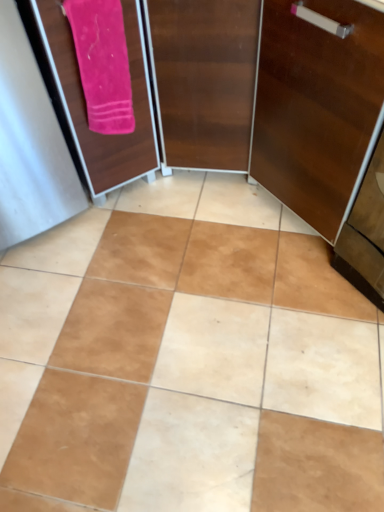
What is the approximate height of pink fabric screen door at upper left?

The height of pink fabric screen door at upper left is 80.57 centimeters.

What do you see at coordinates (85, 103) in the screenshot? I see `pink fabric screen door at upper left` at bounding box center [85, 103].

Describe the element at coordinates (316, 106) in the screenshot. This screenshot has height=512, width=384. I see `wooden cabinet at right` at that location.

In the scene shown: What is the approximate width of brown matte tile at center?

brown matte tile at center is 1.36 meters wide.

Locate an element on the screen. The height and width of the screenshot is (512, 384). brown matte tile at center is located at coordinates (187, 359).

Find the location of a particular element. This screenshot has height=512, width=384. pink fabric screen door at upper left is located at coordinates (85, 103).

Is wooden cabinet at right oriented away from brown matte tile at center?

No.

Is wooden cabinet at right not within brown matte tile at center?

wooden cabinet at right is positioned outside brown matte tile at center.

Is wooden cabinet at right next to brown matte tile at center and touching it?

wooden cabinet at right and brown matte tile at center are clearly separated.

Considering the positions of objects wooden cabinet at right and brown matte tile at center in the image provided, who is more to the left, wooden cabinet at right or brown matte tile at center?

From the viewer's perspective, brown matte tile at center appears more on the left side.

Which object is closer to the camera, brown matte tile at center or pink soft towel at upper left?

Positioned in front is brown matte tile at center.

In the scene shown: Is brown matte tile at center inside the boundaries of pink soft towel at upper left, or outside?

brown matte tile at center is not enclosed by pink soft towel at upper left.

Identify the location of ceramic tile that appears below the pink soft towel at upper left (from a real-world perspective). This screenshot has height=512, width=384. (187, 359).

The image size is (384, 512). What are the coordinates of `screen door below the pink soft towel at upper left (from a real-world perspective)` in the screenshot? It's located at (85, 103).

Considering the relative sizes of pink fabric screen door at upper left and pink soft towel at upper left in the image provided, is pink fabric screen door at upper left shorter than pink soft towel at upper left?

In fact, pink fabric screen door at upper left may be taller than pink soft towel at upper left.

Considering the points (109, 136) and (107, 81), which point is behind, point (109, 136) or point (107, 81)?

Positioned behind is point (109, 136).

Can you tell me how much pink fabric screen door at upper left and pink soft towel at upper left differ in facing direction?

pink fabric screen door at upper left and pink soft towel at upper left are facing 0.187 degrees away from each other.

How many degrees apart are the facing directions of pink soft towel at upper left and wooden cabinet at right?

They differ by 90.2 degrees in their facing directions.

Can you confirm if pink soft towel at upper left is positioned to the left of wooden cabinet at right?

Yes, pink soft towel at upper left is to the left of wooden cabinet at right.

Would you say pink soft towel at upper left is outside wooden cabinet at right?

Absolutely, pink soft towel at upper left is external to wooden cabinet at right.

From a real-world perspective, is pink soft towel at upper left over wooden cabinet at right?

Yes, from a real-world perspective, pink soft towel at upper left is on top of wooden cabinet at right.

Considering the sizes of pink fabric screen door at upper left and brown matte tile at center in the image, is pink fabric screen door at upper left bigger or smaller than brown matte tile at center?

pink fabric screen door at upper left is bigger than brown matte tile at center.

Is pink fabric screen door at upper left inside or outside of brown matte tile at center?

pink fabric screen door at upper left is not inside brown matte tile at center, it's outside.

Would you say pink fabric screen door at upper left is to the left or to the right of brown matte tile at center in the picture?

Based on their positions, pink fabric screen door at upper left is located to the left of brown matte tile at center.

Who is smaller, brown matte tile at center or pink fabric screen door at upper left?

Smaller between the two is brown matte tile at center.

From a real-world perspective, which object rests below the other?

From a 3D spatial view, brown matte tile at center is below.

Is brown matte tile at center positioned with its back to pink fabric screen door at upper left?

brown matte tile at center does not have its back to pink fabric screen door at upper left.

From the picture: Considering the relative positions of brown matte tile at center and pink fabric screen door at upper left in the image provided, is brown matte tile at center to the left or to the right of pink fabric screen door at upper left?

Based on their positions, brown matte tile at center is located to the right of pink fabric screen door at upper left.

Considering the relative positions of pink soft towel at upper left and brown matte tile at center in the image provided, is pink soft towel at upper left behind brown matte tile at center?

Yes, it is behind brown matte tile at center.

Is brown matte tile at center at the back of pink soft towel at upper left?

pink soft towel at upper left does not have its back to brown matte tile at center.

Is pink soft towel at upper left touching brown matte tile at center?

No, pink soft towel at upper left is not making contact with brown matte tile at center.

From a real-world perspective, is pink soft towel at upper left on brown matte tile at center?

Yes.

I want to click on ceramic tile located on the left of wooden cabinet at right, so click(187, 359).

You are a GUI agent. You are given a task and a screenshot of the screen. Output one action in this format:
    pyautogui.click(x=<x>, y=<y>)
    Task: Click on the bath towel behind the brown matte tile at center
    
    Given the screenshot: What is the action you would take?
    pyautogui.click(x=102, y=63)

Based on their spatial positions, is pink soft towel at upper left or pink fabric screen door at upper left further from brown matte tile at center?

pink soft towel at upper left.

Which object lies further to the anchor point wooden cabinet at right, pink soft towel at upper left or brown matte tile at center?

Based on the image, brown matte tile at center appears to be further to wooden cabinet at right.

Estimate the real-world distances between objects in this image. Which object is closer to pink fabric screen door at upper left, pink soft towel at upper left or brown matte tile at center?

Among the two, pink soft towel at upper left is located nearer to pink fabric screen door at upper left.

Based on their spatial positions, is pink soft towel at upper left or wooden cabinet at right further from pink fabric screen door at upper left?

wooden cabinet at right lies further to pink fabric screen door at upper left than the other object.

From the image, which object appears to be nearer to pink fabric screen door at upper left, brown matte tile at center or wooden cabinet at right?

wooden cabinet at right is positioned closer to the anchor pink fabric screen door at upper left.

Looking at the image, which one is located closer to pink soft towel at upper left, brown matte tile at center or wooden cabinet at right?

wooden cabinet at right is closer to pink soft towel at upper left.

Which object lies nearer to the anchor point wooden cabinet at right, brown matte tile at center or pink fabric screen door at upper left?

Based on the image, pink fabric screen door at upper left appears to be nearer to wooden cabinet at right.

Considering their positions, is brown matte tile at center positioned further to pink fabric screen door at upper left than pink soft towel at upper left?

The object further to pink fabric screen door at upper left is brown matte tile at center.

Identify the location of ceramic tile located between pink fabric screen door at upper left and wooden cabinet at right in the left-right direction. Image resolution: width=384 pixels, height=512 pixels. (187, 359).

Image resolution: width=384 pixels, height=512 pixels. Find the location of `bath towel between pink fabric screen door at upper left and brown matte tile at center vertically`. bath towel between pink fabric screen door at upper left and brown matte tile at center vertically is located at coordinates (102, 63).

This screenshot has height=512, width=384. What are the coordinates of `ceramic tile between pink soft towel at upper left and wooden cabinet at right` in the screenshot? It's located at (187, 359).

Image resolution: width=384 pixels, height=512 pixels. Find the location of `bath towel located between pink fabric screen door at upper left and wooden cabinet at right in the left-right direction`. bath towel located between pink fabric screen door at upper left and wooden cabinet at right in the left-right direction is located at coordinates (102, 63).